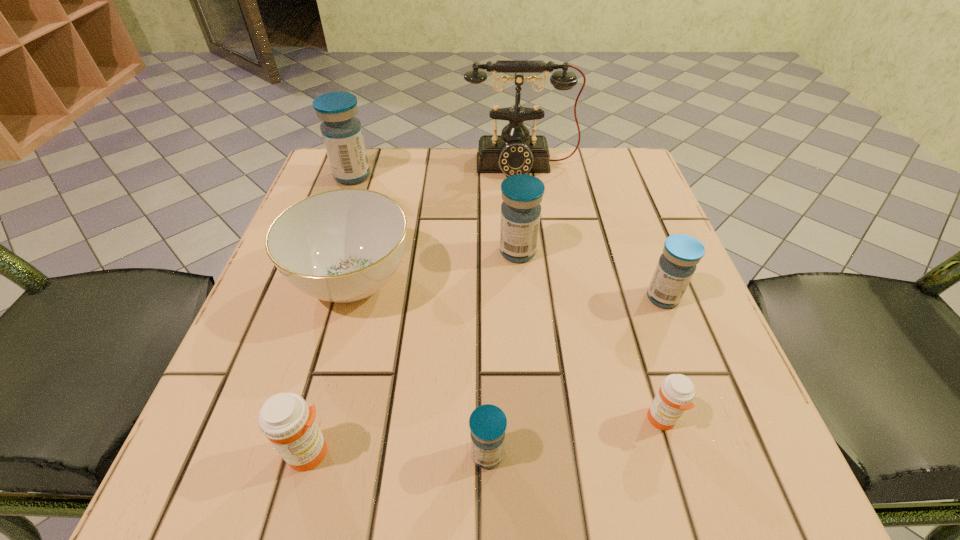
Where is `vacant point that satisfies the following two spatial constraints: 1. on the dial of the tallest object; 2. on the left side of the third biggest blue medicine`? This screenshot has width=960, height=540. vacant point that satisfies the following two spatial constraints: 1. on the dial of the tallest object; 2. on the left side of the third biggest blue medicine is located at coordinates (538, 298).